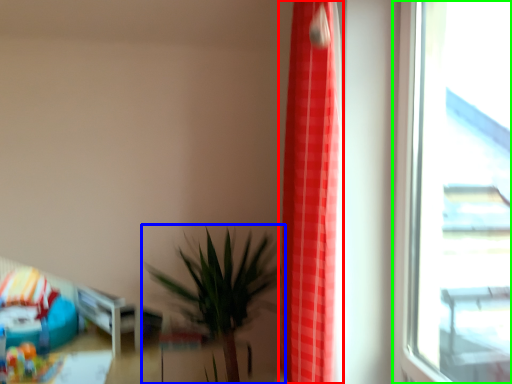
Question: Estimate the real-world distances between objects in this image. Which object is closer to curtain (highlighted by a red box), houseplant (highlighted by a blue box) or window (highlighted by a green box)?

Choices:
 (A) houseplant
 (B) window

Answer: (B)